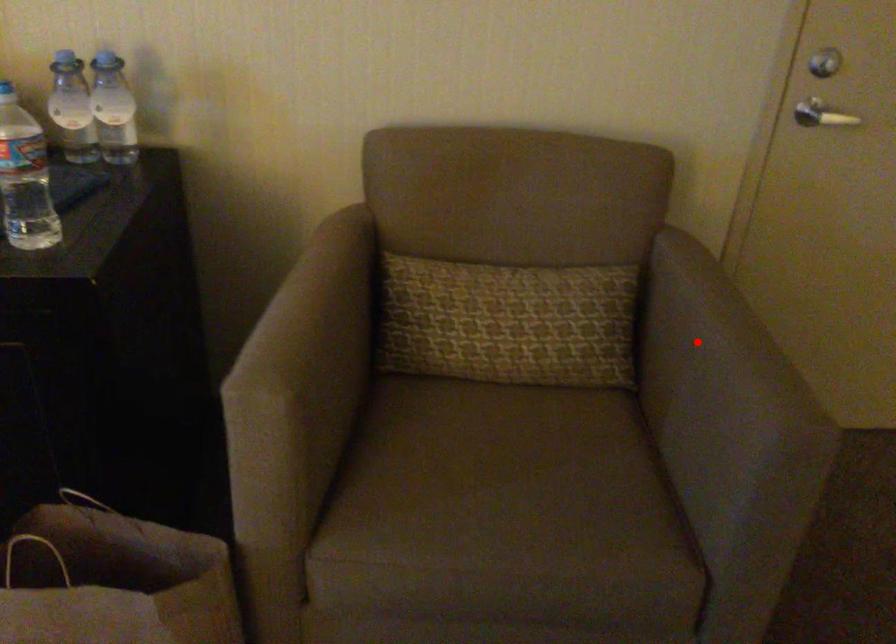
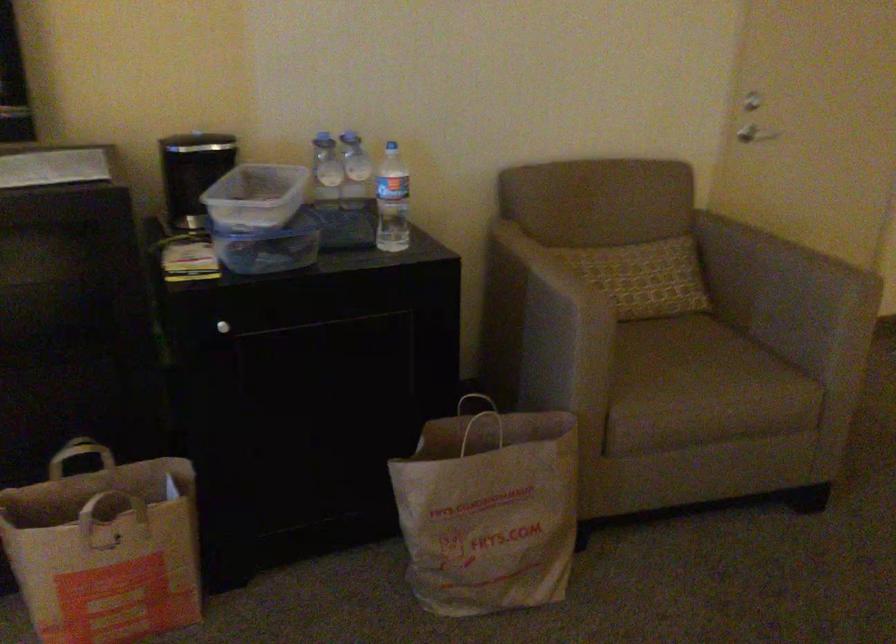
Where in the second image is the point corresponding to the highlighted location from the first image?

(767, 259)